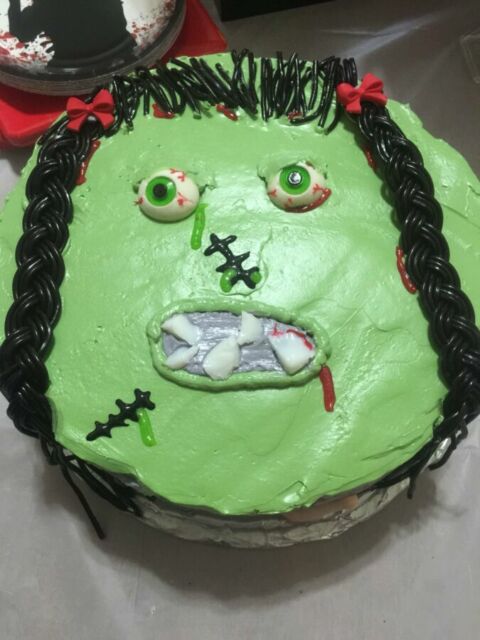
Image resolution: width=480 pixels, height=640 pixels. Find the location of `cloth`. cloth is located at coordinates (52, 575).